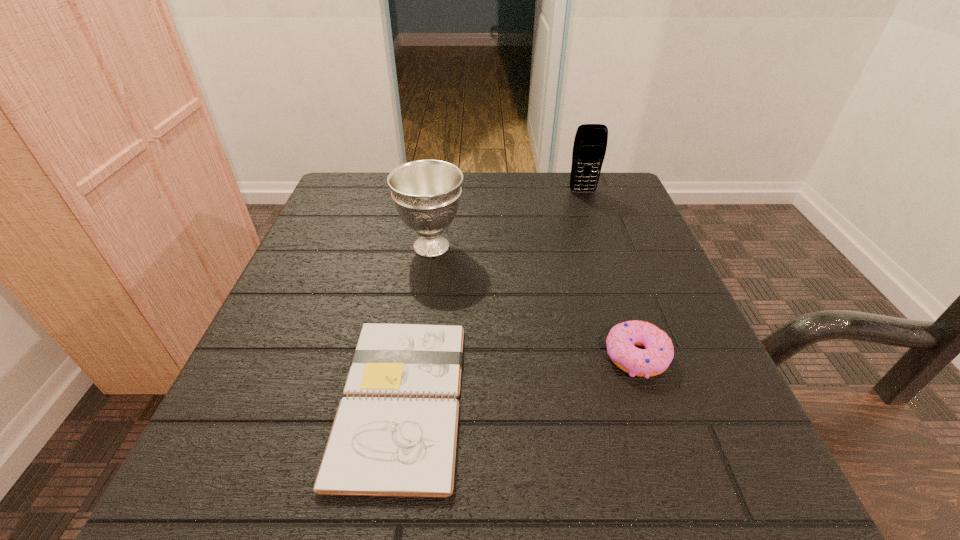
At what (x,y) coordinates should I click in order to perform the action: click on free spot at the near left corner of the desktop. Please return your answer as a coordinate pair (x, y). This screenshot has width=960, height=540. Looking at the image, I should click on (290, 492).

Identify the location of vacant space at the far right corner of the desktop. (641, 222).

The height and width of the screenshot is (540, 960). In the image, there is a desktop. What are the coordinates of `vacant space at the near right corner` in the screenshot? It's located at (708, 457).

Find the location of `empty space that is in between the chalice and the notepad`. empty space that is in between the chalice and the notepad is located at coordinates (417, 323).

What are the coordinates of `unoccupied area between the farthest object and the doughnut` in the screenshot? It's located at (610, 274).

Find the location of a particular element. This screenshot has width=960, height=540. free space between the cellular telephone and the doughnut is located at coordinates (610, 274).

Where is `free space between the farthest object and the third tallest object`? The image size is (960, 540). free space between the farthest object and the third tallest object is located at coordinates (610, 274).

Find the location of a particular element. Image resolution: width=960 pixels, height=540 pixels. vacant point located between the chalice and the notepad is located at coordinates (417, 323).

I want to click on vacant region between the third tallest object and the second farthest object, so pos(534,301).

Image resolution: width=960 pixels, height=540 pixels. What are the coordinates of `vacant space in between the chalice and the notepad` in the screenshot? It's located at (417, 323).